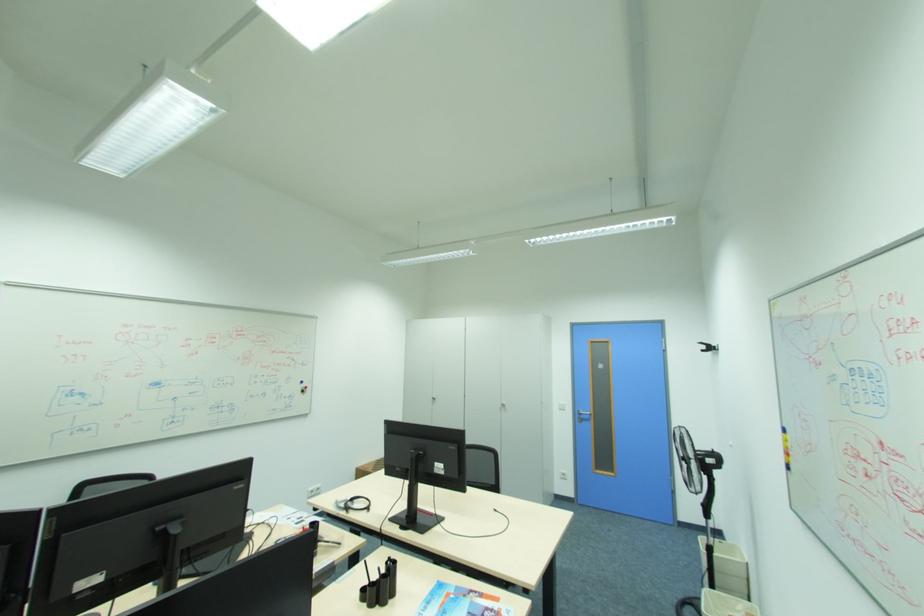
Which object does [777,423] point to?

This point indicates the blue whiteboard marker.